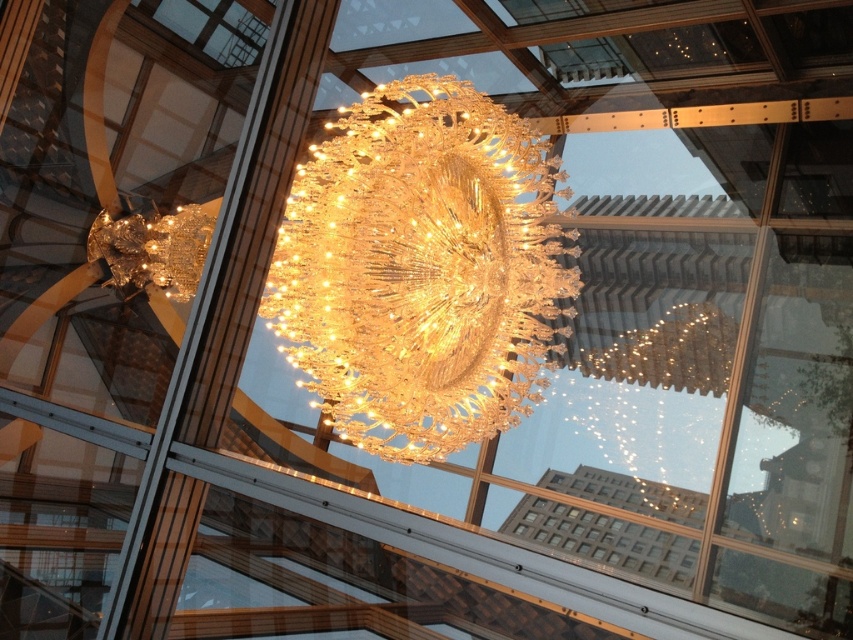
Question: Among these objects, which one is nearest to the camera?

Choices:
 (A) gold crystal chandelier at upper center
 (B) crystal glass chandelier at center

Answer: (B)

Question: Can you confirm if crystal glass chandelier at center is positioned below gold crystal chandelier at upper center?

Choices:
 (A) yes
 (B) no

Answer: (A)

Question: Among these points, which one is nearest to the camera?

Choices:
 (A) (180, 280)
 (B) (312, 220)

Answer: (B)

Question: Does crystal glass chandelier at center appear on the left side of gold crystal chandelier at upper center?

Choices:
 (A) no
 (B) yes

Answer: (A)

Question: Does crystal glass chandelier at center have a smaller size compared to gold crystal chandelier at upper center?

Choices:
 (A) yes
 (B) no

Answer: (B)